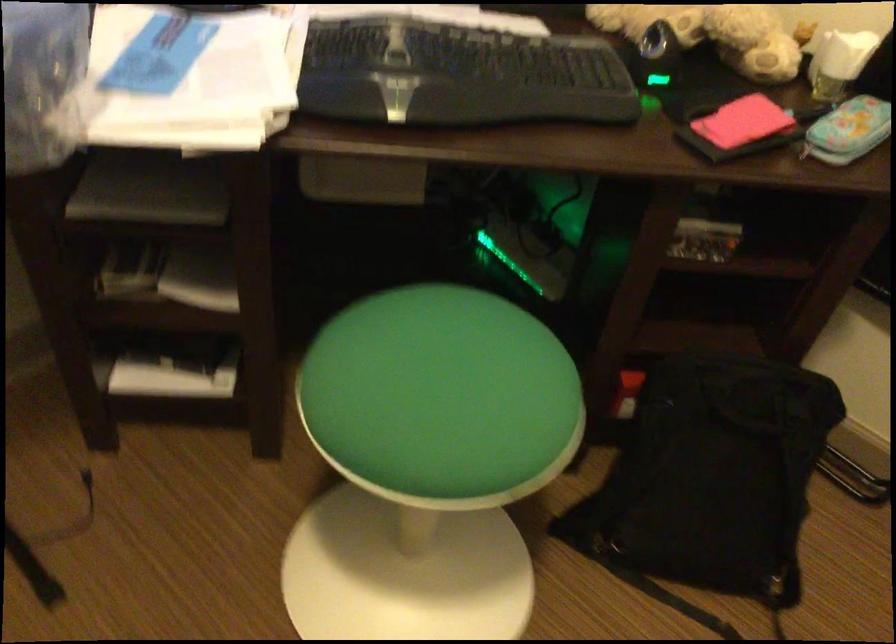
Where would you lift the pink wallet? Please return your answer as a coordinate pair (x, y).

(739, 128)